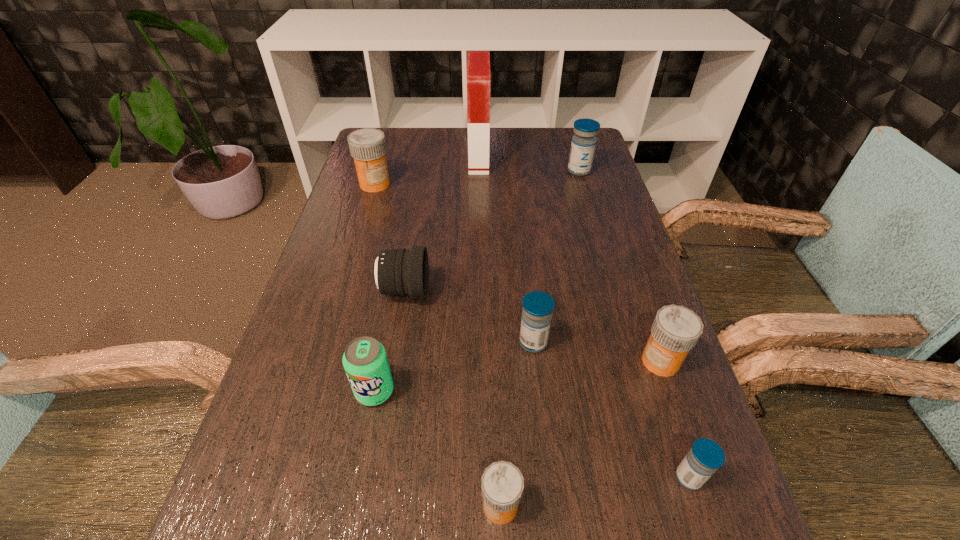
Find the location of a particular element. This screenshot has height=540, width=960. vacant space that is in between the second farthest blue medicine and the pop soda is located at coordinates (454, 367).

The width and height of the screenshot is (960, 540). In order to click on empty space that is in between the tallest object and the smallest blue medicine in this screenshot , I will do `click(584, 318)`.

Select which object appears as the second closest to the nearest blue medicine. Please provide its 2D coordinates. Your answer should be formatted as a tuple, i.e. [(x, y)], where the tuple contains the x and y coordinates of a point satisfying the conditions above.

[(502, 483)]

Select which object appears as the fourth closest to the second medicine from left to right. Please provide its 2D coordinates. Your answer should be formatted as a tuple, i.e. [(x, y)], where the tuple contains the x and y coordinates of a point satisfying the conditions above.

[(676, 329)]

At what (x,y) coordinates should I click in order to perform the action: click on medicine that stands as the fifth closest to the fourth medicine from right to left. Please return your answer as a coordinate pair (x, y). Looking at the image, I should click on (367, 146).

This screenshot has width=960, height=540. I want to click on medicine that is the fourth closest to the pop soda, so click(x=706, y=456).

Find the location of a particular element. blue medicine object that ranks as the closest to the red cigarette_case is located at coordinates (583, 144).

Find the location of a particular element. blue medicine that can be found as the closest to the fourth medicine from right to left is located at coordinates (706, 456).

Identify which orange medicine is located as the second nearest to the tallest object. Please provide its 2D coordinates. Your answer should be formatted as a tuple, i.e. [(x, y)], where the tuple contains the x and y coordinates of a point satisfying the conditions above.

[(676, 329)]

Select which orange medicine is the closest to the leftmost object. Please provide its 2D coordinates. Your answer should be formatted as a tuple, i.e. [(x, y)], where the tuple contains the x and y coordinates of a point satisfying the conditions above.

[(676, 329)]